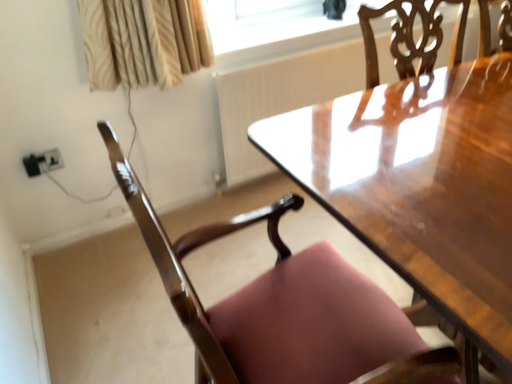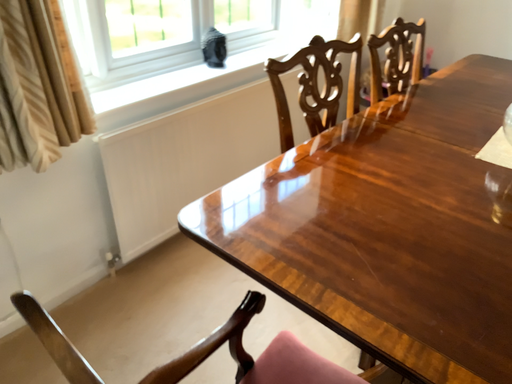
Question: Which way did the camera rotate in the video?

Choices:
 (A) rotated left
 (B) rotated right

Answer: (B)